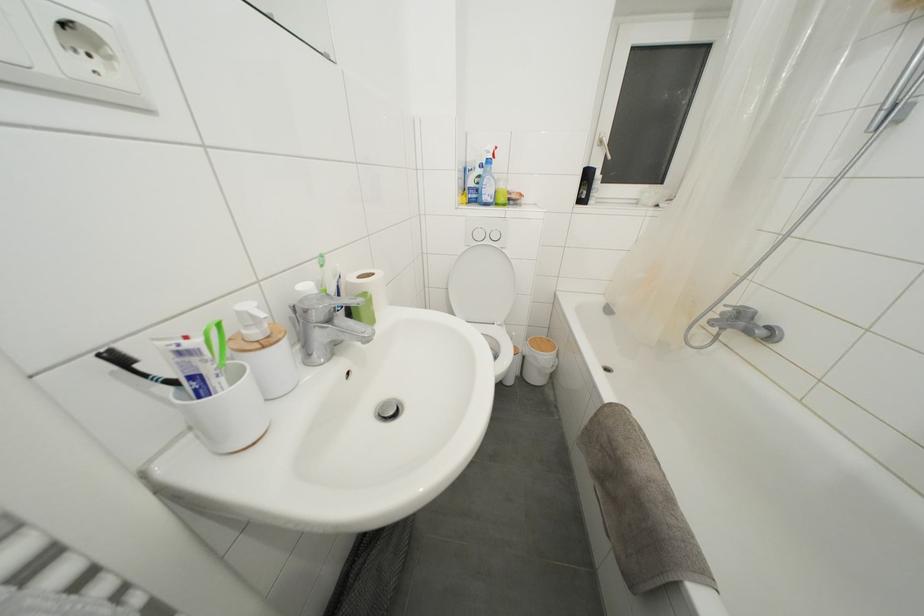
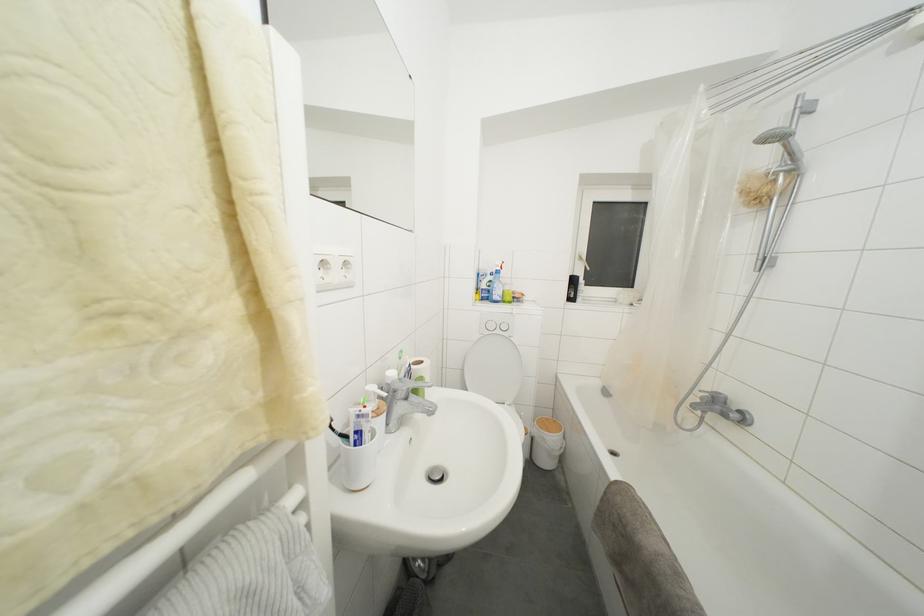
The point at (505, 256) is marked in the first image. Where is the corresponding point in the second image?

(513, 344)